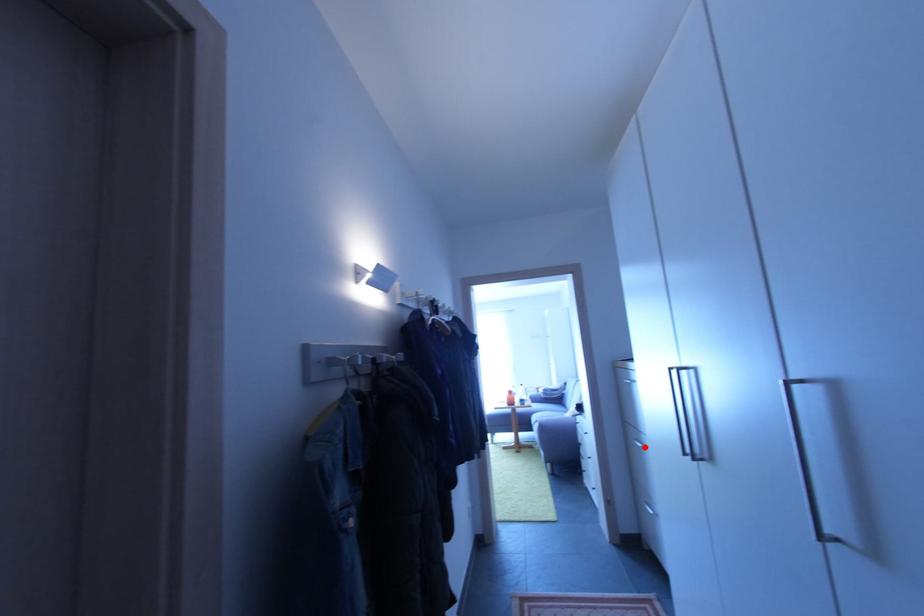
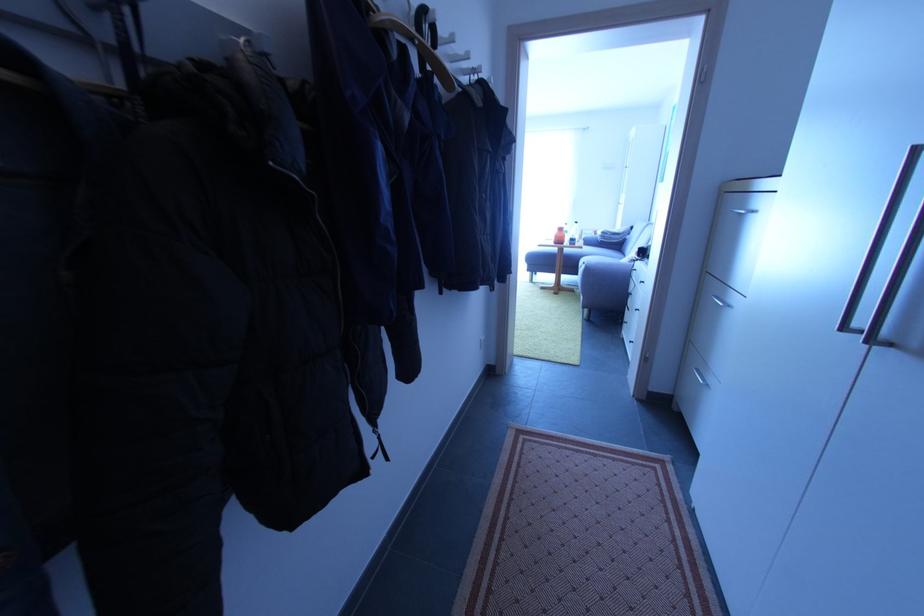
Where in the second image is the point corresponding to the highlighted location from the first image?

(725, 306)